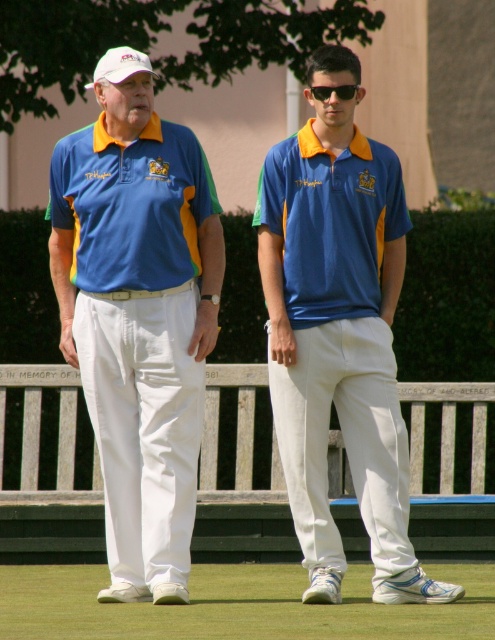
The height and width of the screenshot is (640, 495). Describe the element at coordinates (339, 333) in the screenshot. I see `matte blue polo shirt at center` at that location.

Does matte blue polo shirt at center appear under blue jersey at center?

Indeed, matte blue polo shirt at center is positioned under blue jersey at center.

Who is more forward, (412, 554) or (132, 164)?

Point (412, 554)

Where is `matte blue polo shirt at center`? matte blue polo shirt at center is located at coordinates (339, 333).

Between wooden bench at center and blue jersey at center, which one appears on the right side from the viewer's perspective?

From the viewer's perspective, blue jersey at center appears more on the right side.

Can you confirm if wooden bench at center is smaller than blue jersey at center?

No, wooden bench at center is not smaller than blue jersey at center.

Between point (66, 449) and point (145, 198), which one is positioned in front?

Positioned in front is point (145, 198).

Identify the location of wooden bench at center. This screenshot has width=495, height=640. (48, 468).

Does blue jersey at center lie behind blue matte polo shirt at center?

No, it is not.

Between point (78, 211) and point (376, 202), which one is positioned behind?

The point (376, 202) is behind.

The image size is (495, 640). What are the coordinates of `blue jersey at center` in the screenshot? It's located at (132, 205).